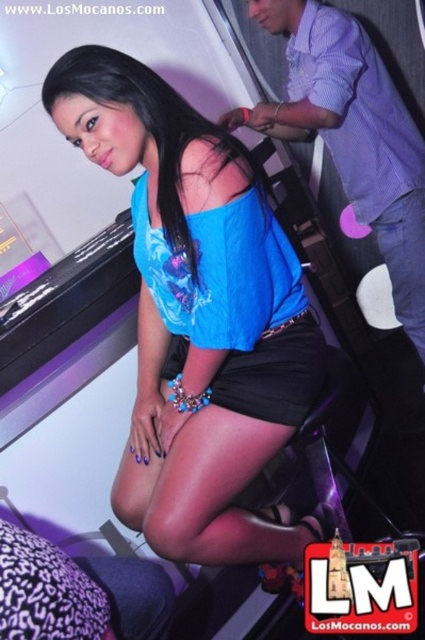
Does blue matte shirt at upper center come behind purple cotton shirt at upper right?

No, blue matte shirt at upper center is in front of purple cotton shirt at upper right.

Can you confirm if blue matte shirt at upper center is wider than purple cotton shirt at upper right?

Correct, the width of blue matte shirt at upper center exceeds that of purple cotton shirt at upper right.

Image resolution: width=425 pixels, height=640 pixels. What do you see at coordinates (197, 314) in the screenshot?
I see `blue matte shirt at upper center` at bounding box center [197, 314].

I want to click on blue matte shirt at upper center, so click(197, 314).

Does blue matte shirt at upper center appear on the right side of purple checkered shirt at upper right?

In fact, blue matte shirt at upper center is to the left of purple checkered shirt at upper right.

Is point (183, 120) closer to camera compared to point (379, 122)?

Yes, point (183, 120) is closer to viewer.

Describe the element at coordinates (197, 314) in the screenshot. I see `blue matte shirt at upper center` at that location.

Locate an element on the screen. This screenshot has height=640, width=425. blue matte shirt at upper center is located at coordinates (197, 314).

Does point (354, 72) come behind point (362, 61)?

No, (354, 72) is closer to viewer.

Where is `purple checkered shirt at upper right`? This screenshot has height=640, width=425. purple checkered shirt at upper right is located at coordinates (353, 134).

Measure the distance between point (x=297, y=51) and camera.

The distance of point (x=297, y=51) from camera is 5.55 feet.

What are the coordinates of `purple checkered shirt at upper right` in the screenshot? It's located at (353, 134).